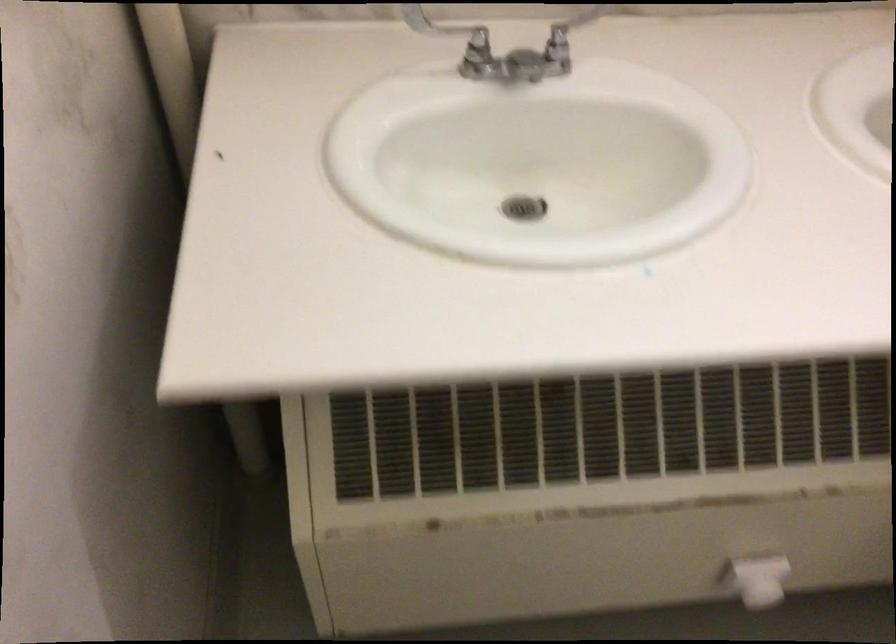
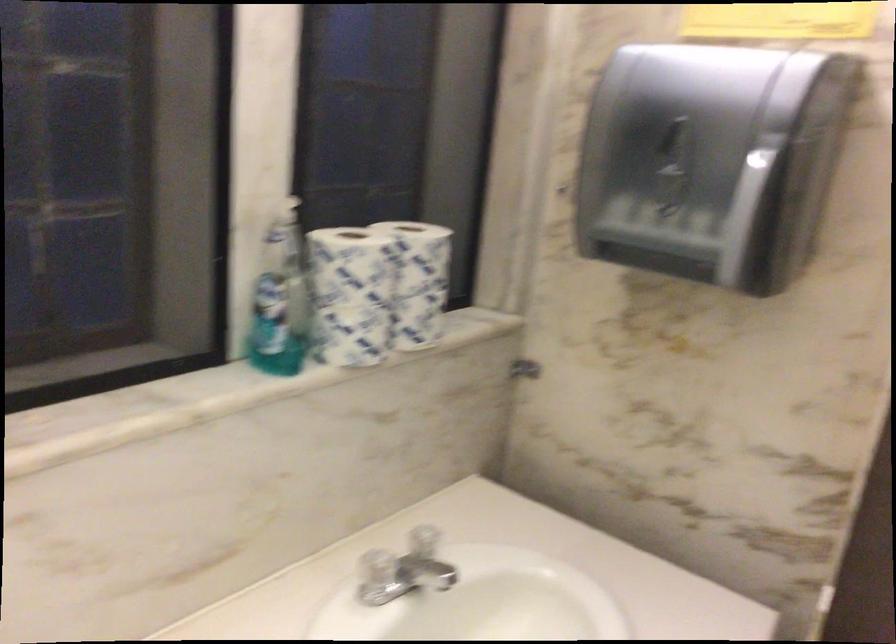
First-person continuous shooting, in which direction is the camera rotating?

The rotation direction of the camera is right-up.